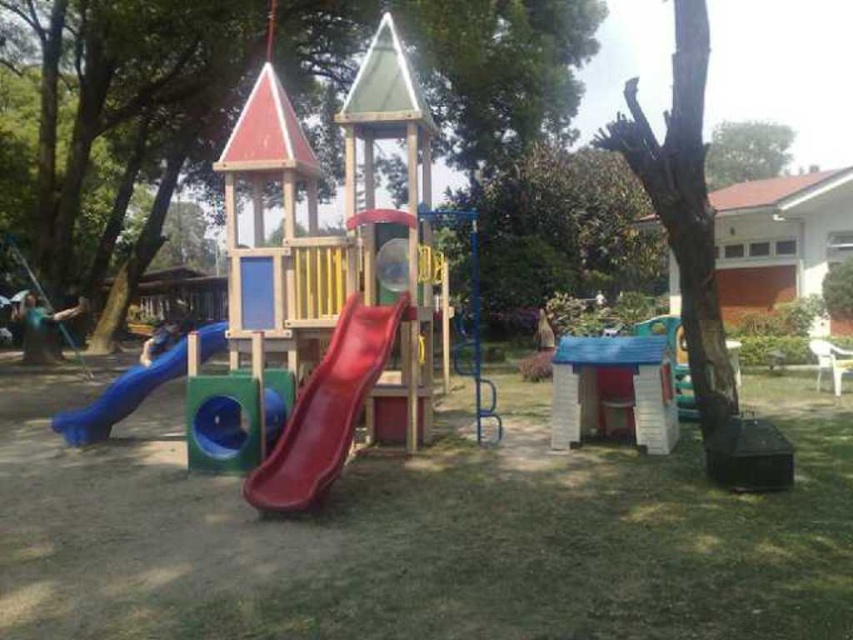
You are a parent trying to decide where to place your child for a photo. You want to ensure the metallic silver swing at left is visible in the background behind the green leafy tree at upper center. Is this possible?

The green leafy tree at upper center is closer to the viewer than the metallic silver swing at left, so yes, you can position the child so that the metallic silver swing at left is visible behind the green leafy tree at upper center.

You are standing at the center of the playground and want to locate the rubber smooth slide at left. According to the coordinates, where is it positioned relative to your current position?

The rubber smooth slide at left is positioned at coordinates 0.622 on the x axis and 0.141 on the y axis, which places it to the right and slightly forward from your central position.

You are a parent trying to locate your child who is hiding behind the green leafy tree at center. Your friend says the child is actually behind the green leafy tree at upper center. Which tree is further to the left?

The green leafy tree at center is further to the left compared to the green leafy tree at upper center.